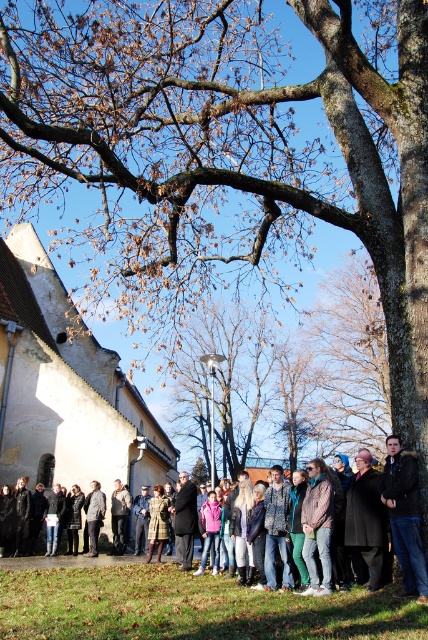
You are standing at the center of the image and want to find the brown rough tree at center. In which direction should you look to locate it?

The brown rough tree at center is located at point coordinates of (x=222, y=380), so it is slightly to the right and down from the exact center of the image.

You are standing at the point marked as point (68, 388) in the image. What is the nearest object to you in the scene?

The nearest object to you is the white stucco church at left because the point (68, 388) is located on it.

In the scene shown: You are planning to take a photo of the group under the large tree. The white stucco church at left and the dark gray fabric jacket at center are both in the frame. Which object should you focus on to ensure both are in focus without adjusting your camera settings?

The white stucco church at left is bigger than the dark gray fabric jacket at center, so focusing on the white stucco church at left would help ensure both are in focus since it is larger and likely closer to the camera.